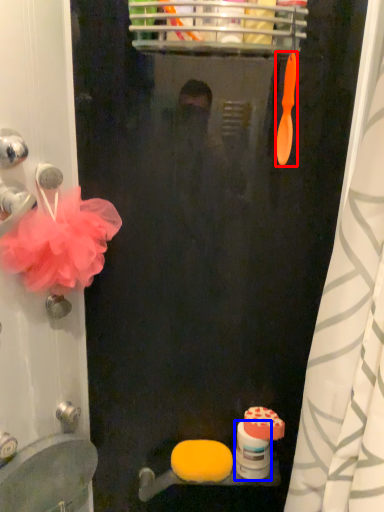
Question: Among these objects, which one is nearest to the camera, brush (highlighted by a red box) or toilet paper (highlighted by a blue box)?

Choices:
 (A) brush
 (B) toilet paper

Answer: (A)